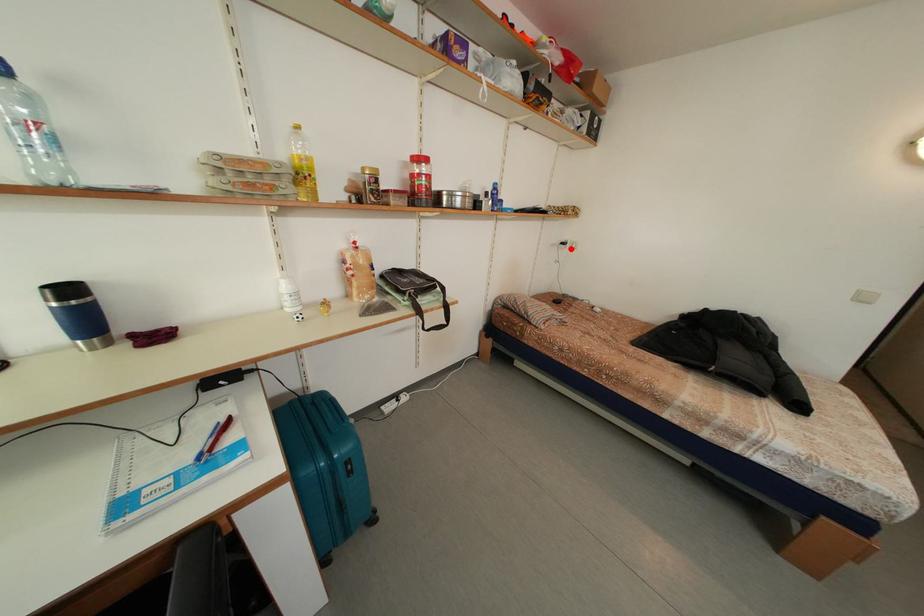
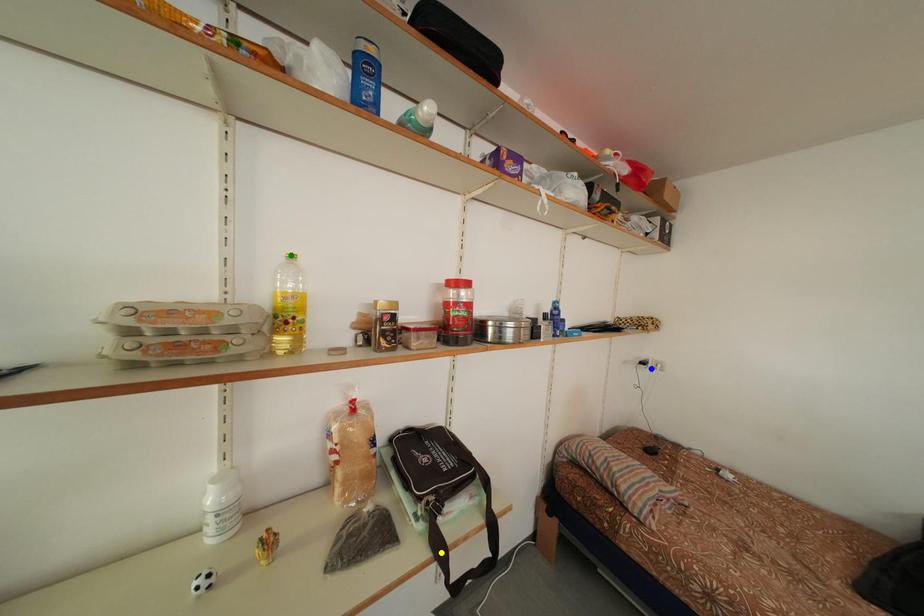
Question: I am providing you with two images of the same scene from different viewpoints. A red point is marked on the first image. You are given multiple points on the second image. Which point in image 2 represents the same 3d spot as the red point in image 1?

Choices:
 (A) blue point
 (B) green point
 (C) yellow point

Answer: (A)